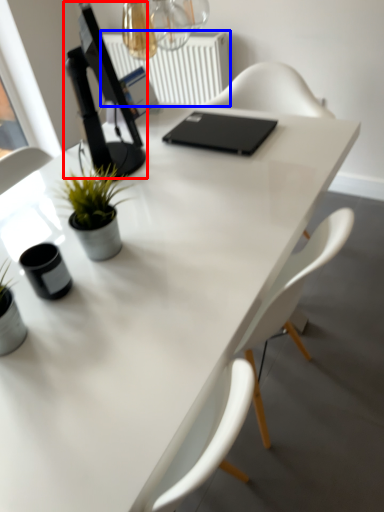
Question: Which object is further to the camera taking this photo, computer monitor (highlighted by a red box) or radiator (highlighted by a blue box)?

Choices:
 (A) computer monitor
 (B) radiator

Answer: (B)